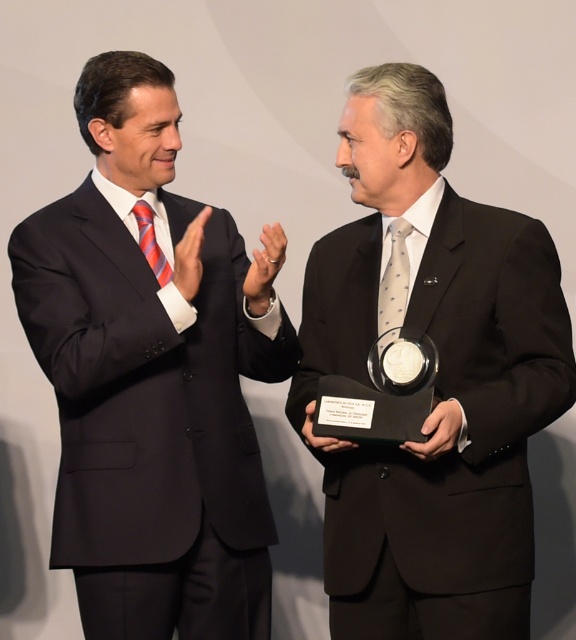
You are a photographer who needs to adjust the lighting between the two men wearing matte black suits. The distance between them is crucial for the lighting setup. Can you confirm if the space between the matte black suit at left and the black matte suit at center is more than 16 inches?

The matte black suit at left and black matte suit at center are 17.42 inches apart from each other, which is more than 16 inches. Therefore, the space between them is sufficient for the lighting setup.

Based on the photo, you are standing 5 feet away from the image. Is the point at coordinates point (139, 445) closer to you than the frame edge?

The distance of point (139, 445) from viewer is 6.06 feet, so since you are standing 5 feet away from the image, the point is farther away than you are.

You are a photographer adjusting the focus on your camera. You notice two points in the image at coordinates point (150, 196) and point (418, 502). Which point should you focus on first to ensure the subject closest to the camera is sharp?

You should focus on point (150, 196) first because it is closer to the camera than point (418, 502), ensuring the nearest subject is in sharp focus.